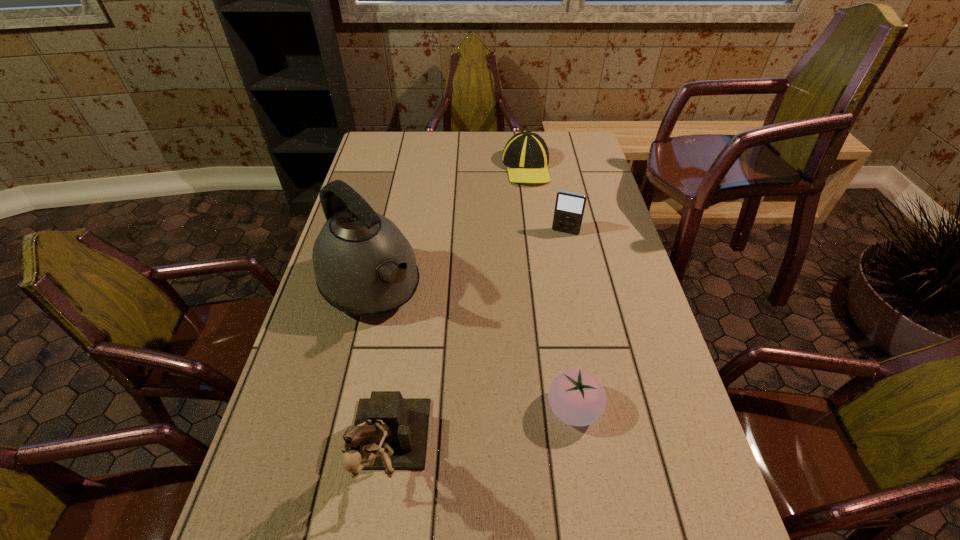
Where is `empty space between the third farthest object and the baseball cap`? The width and height of the screenshot is (960, 540). empty space between the third farthest object and the baseball cap is located at coordinates (448, 227).

Image resolution: width=960 pixels, height=540 pixels. I want to click on free spot between the kettle and the farthest object, so click(x=448, y=227).

Identify the location of unoccupied area between the third farthest object and the iPod. The width and height of the screenshot is (960, 540). (468, 260).

At what (x,y) coordinates should I click in order to perform the action: click on empty space between the kettle and the figurine. Please return your answer as a coordinate pair (x, y). The image size is (960, 540). Looking at the image, I should click on (379, 372).

Locate an element on the screen. This screenshot has height=540, width=960. free space between the tomato and the baseball cap is located at coordinates (550, 288).

At what (x,y) coordinates should I click in order to perform the action: click on object that ranks as the fourth closest to the farthest object. Please return your answer as a coordinate pair (x, y). Looking at the image, I should click on (390, 432).

Where is `object that ranks as the third closest to the farthest object`? This screenshot has height=540, width=960. object that ranks as the third closest to the farthest object is located at coordinates click(x=577, y=397).